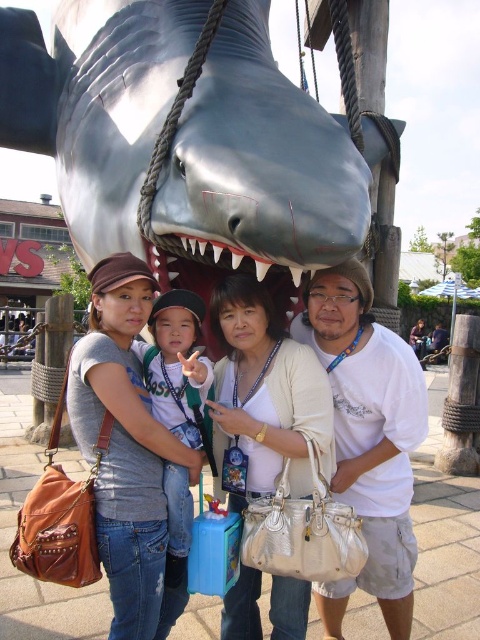
You are a photographer trying to capture a photo of the shiny metallic shark at center and the denim jeans at center. Which object should you focus on first if you want to ensure both are in focus, considering their heights?

The shiny metallic shark at center is taller than the denim jeans at center, so you should focus on the shiny metallic shark at center first to ensure both are in focus.

You are a photographer trying to capture the group in front of the shiny metallic shark at center. Since the denim jeans at center is smaller than the shark, where should you position the camera to ensure both the group and the shark are in frame?

The shiny metallic shark at center is larger than the denim jeans at center. To include both the group and the shark in the frame, position the camera slightly closer to the group so the shark remains visible in the background without overwhelming the subjects.

You are a photographer who needs to adjust the lighting to highlight both the matte white purse at center and the denim jeans at center. Since the purse is below the jeans, where should you position the light source to ensure both items are well illuminated?

The matte white purse at center is below the denim jeans at center. To illuminate both effectively, position the light source above the denim jeans at center so that it can reach both the purse and the jeans.